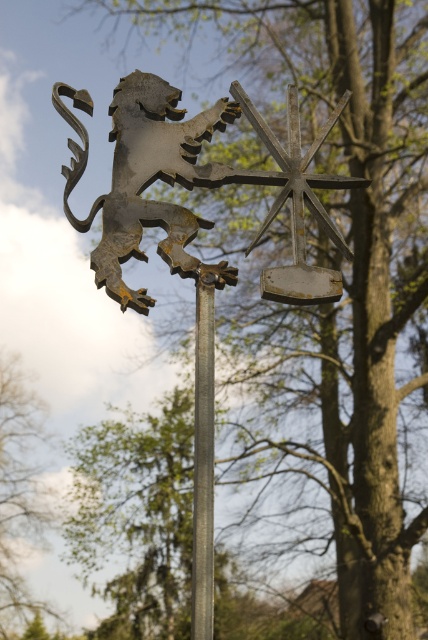
You are standing in front of the metal signpost and need to locate the rusty metal lion at upper left. What are the coordinates of its position?

The coordinates of the rusty metal lion at upper left are at point (143, 177).

You are a hiker trying to determine the tallest object between the green leafy tree at lower left and the polished metal pole at center. Based on the scene, which object is taller?

The green leafy tree at lower left is taller than the polished metal pole at center.

You are standing 100 feet away from the signpost. The point at coordinates point (x=2, y=476) is part of the signpost. Is the point closer to you or farther away than your current position?

The point at coordinates point (x=2, y=476) is 138.08 feet from the camera, which means it is farther away than your current position of 100 feet.